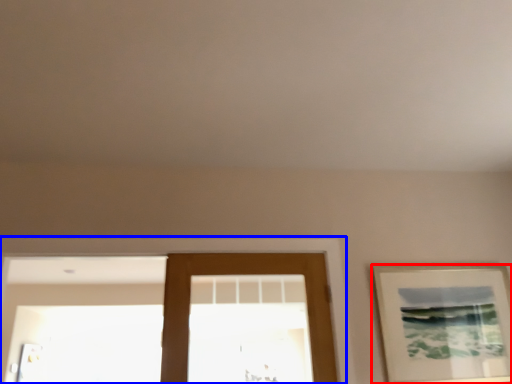
Question: Which point is further to the camera, picture frame (highlighted by a red box) or window frame (highlighted by a blue box)?

Choices:
 (A) picture frame
 (B) window frame

Answer: (A)